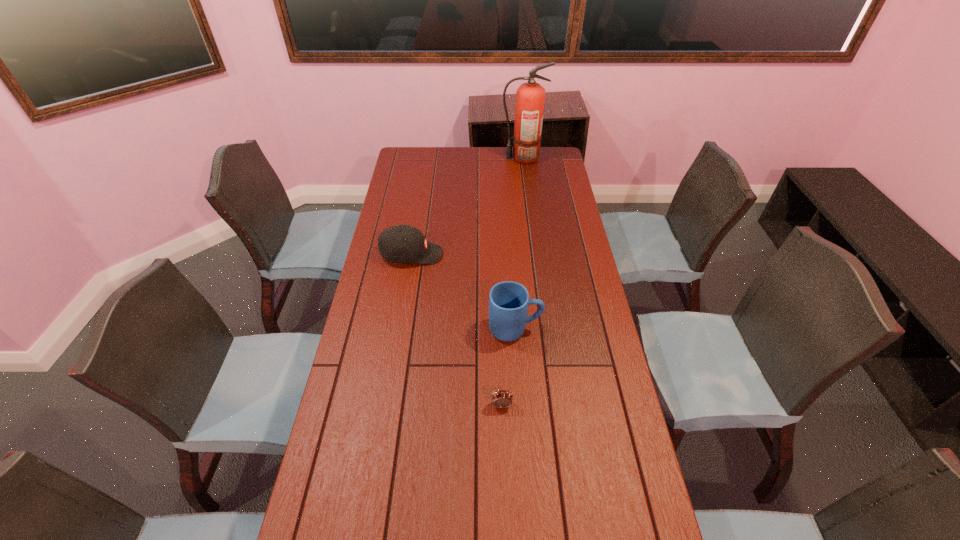
Where is `free space that satisfies the following two spatial constraints: 1. on the side of the second tallest object with the handle; 2. on the face of the shortest object`? free space that satisfies the following two spatial constraints: 1. on the side of the second tallest object with the handle; 2. on the face of the shortest object is located at coordinates (520, 405).